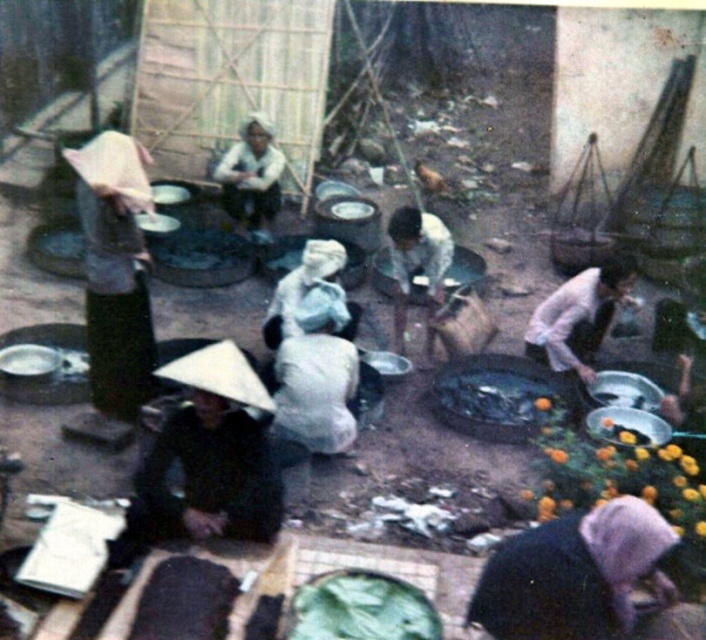
Does matte black conical hat at left come behind light pink fabric at lower right?

No, matte black conical hat at left is in front of light pink fabric at lower right.

Does matte black conical hat at left have a lesser width compared to light pink fabric at lower right?

Indeed, matte black conical hat at left has a lesser width compared to light pink fabric at lower right.

Find the location of a particular element. The width and height of the screenshot is (706, 640). matte black conical hat at left is located at coordinates (114, 284).

Locate an element on the screen. This screenshot has width=706, height=640. matte black conical hat at left is located at coordinates (114, 284).